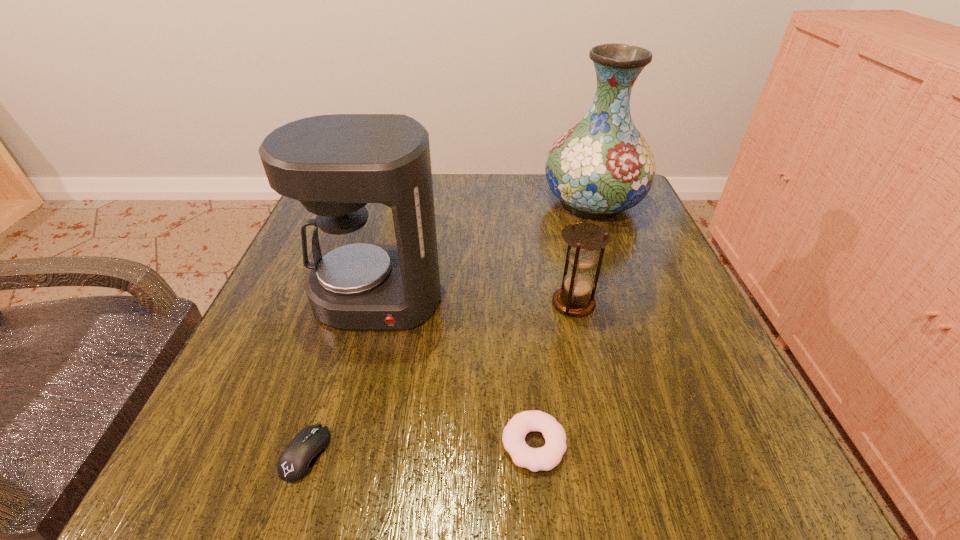
This screenshot has width=960, height=540. I want to click on object present at the far edge, so click(x=603, y=165).

Identify the location of computer equipment that is at the near edge. Image resolution: width=960 pixels, height=540 pixels. (296, 461).

You are a GUI agent. You are given a task and a screenshot of the screen. Output one action in this format:
    pyautogui.click(x=<x>, y=<y>)
    Task: Click on the doughnut situated at the near edge
    
    Given the screenshot: What is the action you would take?
    pyautogui.click(x=545, y=458)

This screenshot has height=540, width=960. Find the location of `coffee maker that is at the left edge`. coffee maker that is at the left edge is located at coordinates (334, 165).

Where is `computer equipment located at the left edge`? computer equipment located at the left edge is located at coordinates (296, 461).

At what (x,y) coordinates should I click in order to perform the action: click on object located at the right edge. Please return your answer as a coordinate pair (x, y). Looking at the image, I should click on (603, 165).

Locate an element on the screen. This screenshot has height=540, width=960. object that is at the near left corner is located at coordinates (296, 461).

Identify the location of object situated at the far right corner. The height and width of the screenshot is (540, 960). (603, 165).

Where is `vacant region at the far edge of the desktop`? The image size is (960, 540). vacant region at the far edge of the desktop is located at coordinates tap(493, 190).

Identify the location of free space at the near edge of the desktop. (487, 466).